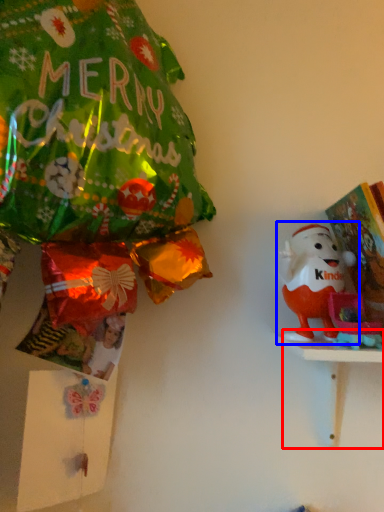
Question: Which object appears closest to the camera in this image, table (highlighted by a red box) or toy (highlighted by a blue box)?

Choices:
 (A) table
 (B) toy

Answer: (A)